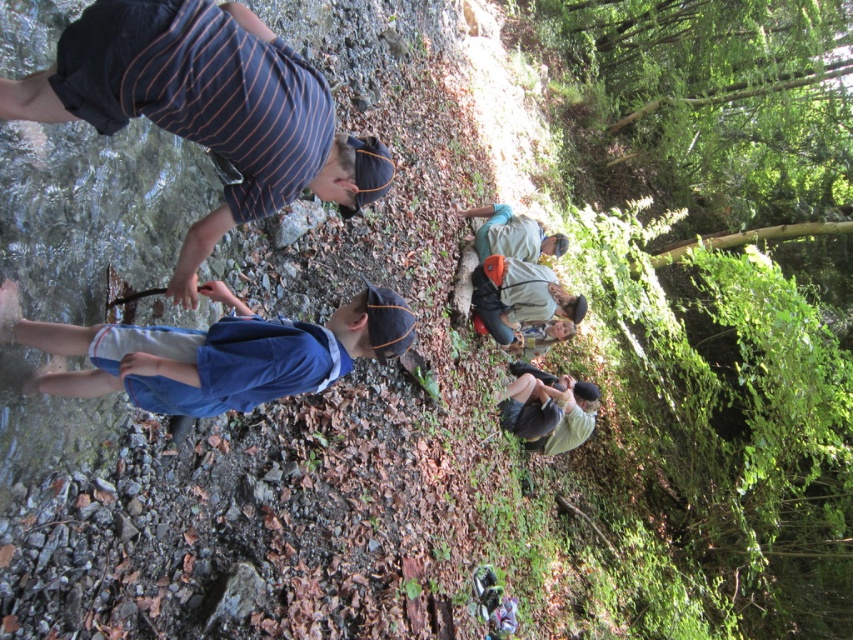
You are a hiker who wants to place a small backpack between the striped cotton shirt at upper left and the light green fabric at lower right. Based on their heights, which object should the backpack be placed closer to?

The striped cotton shirt at upper left has a greater height compared to light green fabric at lower right, so the backpack should be placed closer to the light green fabric at lower right to ensure stability.

You are a photographer trying to capture a candid shot of the striped cotton shirt at upper left without being noticed. The camera you are using has a minimum focusing distance of 2 meters. Can you take the photo from your current position?

The striped cotton shirt at upper left and camera are 1.84 meters apart from each other. Since the minimum focusing distance is 2 meters, you cannot take the photo from your current position because the distance is too close.

You are a hiker trying to identify clothing items in the scene. Which clothing item is bigger in size between the striped cotton shirt at upper left and the light green fabric at lower right?

The striped cotton shirt at upper left is larger in size compared to the light green fabric at lower right.